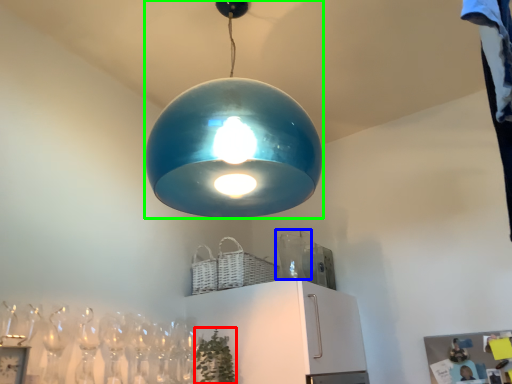
Question: Which object is the closest to the plant (highlighted by a red box)? Choose among these: glass vase (highlighted by a blue box) or lamp (highlighted by a green box).

Choices:
 (A) glass vase
 (B) lamp

Answer: (A)